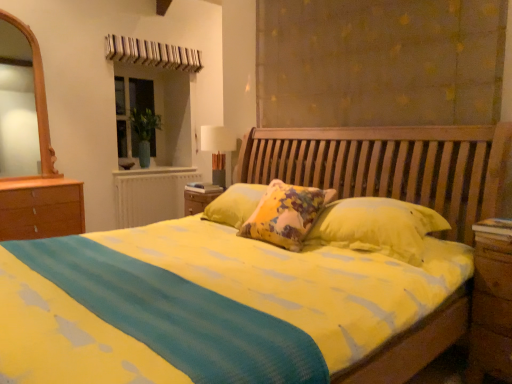
You are a GUI agent. You are given a task and a screenshot of the screen. Output one action in this format:
    pyautogui.click(x=<x>, y=<y>)
    Task: Click on the white painted radiator at center
    
    Given the screenshot: What is the action you would take?
    pyautogui.click(x=151, y=194)

Describe the element at coordinates (490, 302) in the screenshot. The width and height of the screenshot is (512, 384). I see `brown wooden nightstand at right` at that location.

Describe the element at coordinates (156, 112) in the screenshot. I see `green glass vase at upper left` at that location.

The height and width of the screenshot is (384, 512). What do you see at coordinates (218, 149) in the screenshot?
I see `white fabric lampshade at upper center` at bounding box center [218, 149].

Identify the location of matte brown curtain at upper center. (379, 62).

Can white painted radiator at center be found inside matte brown curtain at upper center?

Definitely not — white painted radiator at center is not inside matte brown curtain at upper center.

Considering the positions of objects matte brown curtain at upper center and white painted radiator at center in the image provided, who is more to the left, matte brown curtain at upper center or white painted radiator at center?

From the viewer's perspective, white painted radiator at center appears more on the left side.

Would you say matte brown curtain at upper center is a long distance from white painted radiator at center?

matte brown curtain at upper center is far away from white painted radiator at center.

Based on the photo, which is nearer, (261,13) or (117,204)?

Point (261,13)

How distant is green glass vase at upper left from white painted radiator at center?

They are 28.55 inches apart.

Between green glass vase at upper left and white painted radiator at center, which one appears on the right side from the viewer's perspective?

Positioned to the right is white painted radiator at center.

From the picture: Would you say green glass vase at upper left is outside white painted radiator at center?

Indeed, green glass vase at upper left is completely outside white painted radiator at center.

How many degrees apart are the facing directions of white painted radiator at center and matte brown curtain at upper center?

They differ by 89.4 degrees in their facing directions.

Does white painted radiator at center lie behind matte brown curtain at upper center?

Yes, white painted radiator at center is further from the viewer.

Could you tell me if white painted radiator at center is turned towards matte brown curtain at upper center?

No, white painted radiator at center is not oriented towards matte brown curtain at upper center.

This screenshot has height=384, width=512. I want to click on curtain in front of the white painted radiator at center, so click(x=379, y=62).

Would you say green glass vase at upper left is a long distance from white fabric lampshade at upper center?

That's right, there is a large distance between green glass vase at upper left and white fabric lampshade at upper center.

Is green glass vase at upper left wider or thinner than white fabric lampshade at upper center?

Clearly, green glass vase at upper left has less width compared to white fabric lampshade at upper center.

Between green glass vase at upper left and white fabric lampshade at upper center, which one has more height?

With more height is green glass vase at upper left.

Is green glass vase at upper left at the right side of white fabric lampshade at upper center?

Result: Incorrect, green glass vase at upper left is not on the right side of white fabric lampshade at upper center.

Does point (489, 240) appear closer or farther from the camera than point (223, 184)?

Clearly, point (489, 240) is closer to the camera than point (223, 184).

How distant is brown wooden nightstand at right from white fabric lampshade at upper center?

brown wooden nightstand at right and white fabric lampshade at upper center are 2.11 meters apart.

Does brown wooden nightstand at right touch white fabric lampshade at upper center?

No, brown wooden nightstand at right is not making contact with white fabric lampshade at upper center.

Does brown wooden nightstand at right have a greater width compared to white fabric lampshade at upper center?

Yes.

Is brown wooden nightstand at right bigger than white painted radiator at center?

Incorrect, brown wooden nightstand at right is not larger than white painted radiator at center.

From a real-world perspective, is brown wooden nightstand at right positioned above or below white painted radiator at center?

brown wooden nightstand at right is situated lower than white painted radiator at center in the real world.

Which of these two, brown wooden nightstand at right or white painted radiator at center, stands taller?

brown wooden nightstand at right.

Is matte brown curtain at upper center in front of or behind green glass vase at upper left in the image?

matte brown curtain at upper center is positioned closer to the viewer than green glass vase at upper left.

Could you tell me if matte brown curtain at upper center is turned towards green glass vase at upper left?

No, matte brown curtain at upper center is not facing towards green glass vase at upper left.

Can you tell me how much matte brown curtain at upper center and green glass vase at upper left differ in facing direction?

The angular difference between matte brown curtain at upper center and green glass vase at upper left is 89 degrees.

Between matte brown curtain at upper center and green glass vase at upper left, which one has smaller size?

With smaller size is green glass vase at upper left.

The image size is (512, 384). I want to click on radiator that appears behind the matte brown curtain at upper center, so click(151, 194).

At what (x,y) coordinates should I click in order to perform the action: click on radiator that is under the green glass vase at upper left (from a real-world perspective). Please return your answer as a coordinate pair (x, y). The width and height of the screenshot is (512, 384). Looking at the image, I should click on (151, 194).

Considering their positions, is white painted radiator at center positioned further to white fabric lampshade at upper center than brown wooden nightstand at right?

Based on the image, brown wooden nightstand at right appears to be further to white fabric lampshade at upper center.

Which object lies further to the anchor point green glass vase at upper left, white fabric lampshade at upper center or brown wooden nightstand at right?

brown wooden nightstand at right lies further to green glass vase at upper left than the other object.

Estimate the real-world distances between objects in this image. Which object is further from white painted radiator at center, brown wooden nightstand at right or matte brown curtain at upper center?

brown wooden nightstand at right is positioned further to the anchor white painted radiator at center.

From the image, which object appears to be nearer to brown wooden nightstand at right, green glass vase at upper left or white fabric lampshade at upper center?

The object closer to brown wooden nightstand at right is white fabric lampshade at upper center.

From the image, which object appears to be nearer to green glass vase at upper left, matte brown curtain at upper center or brown wooden nightstand at right?

Among the two, matte brown curtain at upper center is located nearer to green glass vase at upper left.

From the image, which object appears to be nearer to matte brown curtain at upper center, green glass vase at upper left or brown wooden nightstand at right?

Among the two, brown wooden nightstand at right is located nearer to matte brown curtain at upper center.

From the image, which object appears to be farther from white fabric lampshade at upper center, brown wooden nightstand at right or matte brown curtain at upper center?

brown wooden nightstand at right.

Consider the image. Estimate the real-world distances between objects in this image. Which object is further from brown wooden nightstand at right, white painted radiator at center or white fabric lampshade at upper center?

white painted radiator at center is further to brown wooden nightstand at right.

Locate an element on the screen. Image resolution: width=512 pixels, height=384 pixels. table lamp between brown wooden nightstand at right and green glass vase at upper left from front to back is located at coordinates (x=218, y=149).

This screenshot has width=512, height=384. I want to click on curtain between brown wooden nightstand at right and white painted radiator at center from front to back, so click(379, 62).

The width and height of the screenshot is (512, 384). In order to click on radiator located between white fabric lampshade at upper center and green glass vase at upper left in the depth direction in this screenshot , I will do `click(151, 194)`.

Where is `curtain between brown wooden nightstand at right and green glass vase at upper left in the front-back direction`? curtain between brown wooden nightstand at right and green glass vase at upper left in the front-back direction is located at coordinates (379, 62).